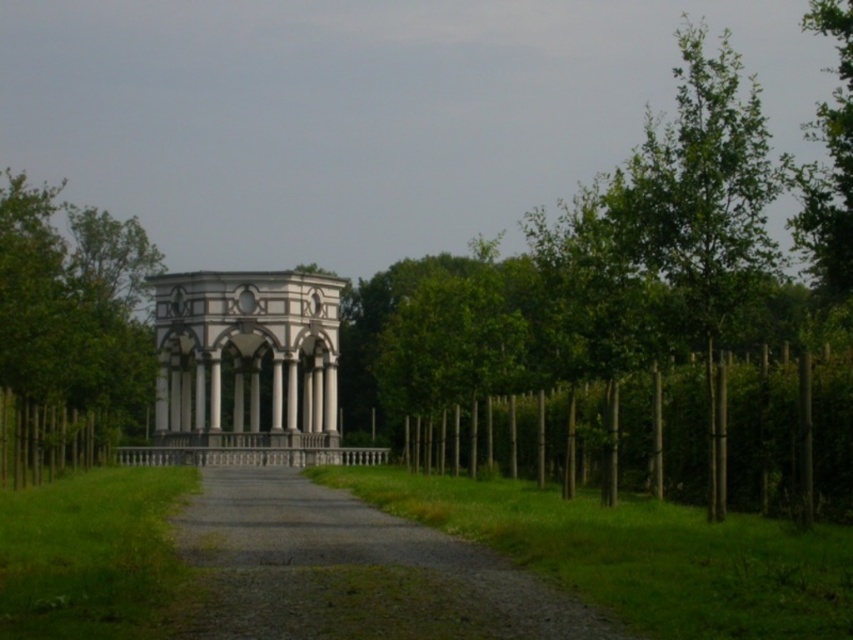
Is gravelly path at center to the left of green leafy hedge at right from the viewer's perspective?

Indeed, gravelly path at center is positioned on the left side of green leafy hedge at right.

Measure the distance between gravelly path at center and camera.

gravelly path at center and camera are 147.83 feet apart from each other.

Identify the location of gravelly path at center. (352, 570).

Does gravelly path at center appear under green leafy tree at left?

Indeed, gravelly path at center is positioned under green leafy tree at left.

What do you see at coordinates (352, 570) in the screenshot? This screenshot has width=853, height=640. I see `gravelly path at center` at bounding box center [352, 570].

In order to click on gravelly path at center in this screenshot , I will do [x=352, y=570].

Who is positioned more to the left, green leafy hedge at right or white marble gazebo at center?

white marble gazebo at center

Is point (743, 362) more distant than point (196, 396)?

That is False.

Which is behind, point (764, 390) or point (320, 419)?

Point (320, 419)

This screenshot has height=640, width=853. In order to click on green leafy hedge at right in this screenshot , I will do `click(785, 436)`.